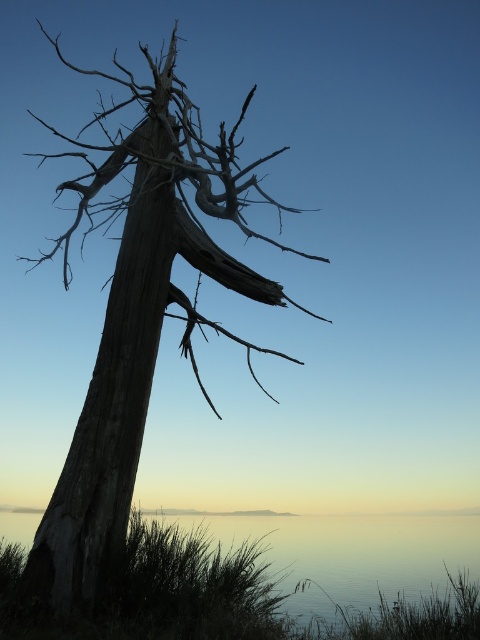
You are an artist sketching the scene. You notice the gray textured wood at left and the gray rough bark tree trunk at left. Which object is positioned more to the right side of the image?

The gray textured wood at left is positioned more to the right side of the image compared to the gray rough bark tree trunk at left.

You have a small wooden boat that is 1 meter wide. You want to sail it across the water in the scene. Can the gray textured wood at left and the smooth glass water at lower center accommodate your boat? Explain your reasoning.

The smooth glass water at lower center is wider than the gray textured wood at left. Since the boat is 1 meter wide, it can fit on the smooth glass water at lower center if its width is at least 1 meter. However, the gray textured wood at left is narrower, so the boat cannot be placed there.

You are an artist planning to paint the scene. You want to ensure the proportions between the gray rough bark tree trunk at left and the smooth glass water at lower center are accurate. Which object should you depict as taller in your painting?

The gray rough bark tree trunk at left should be depicted as much taller than the smooth glass water at lower center in the painting, as stated in the description.